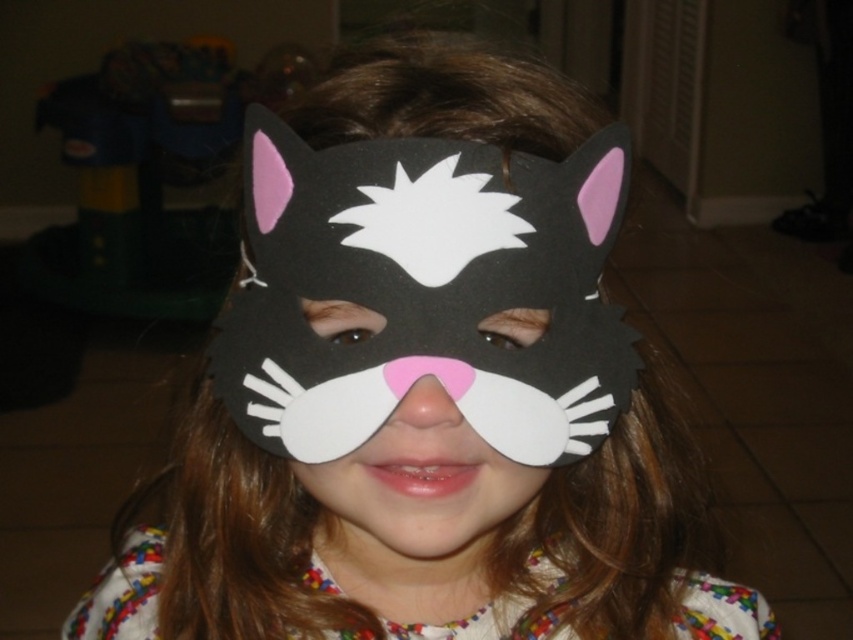
You are a photographer adjusting your camera to focus on two points in the image. The first point is at coordinates point (x=286, y=342) and the second point is at point (x=326, y=518). Which point should you focus on first if you want to capture the closest object to the camera?

Point (x=286, y=342) is closer to the viewer than point (x=326, y=518), so you should focus on point (x=286, y=342) first to capture the closest object.

The child is wearing a handmade cat mask. Which mask is visible on top, the matte foam cat mask at center or the matte felt mask at center?

The matte foam cat mask at center is positioned over the matte felt mask at center, so the matte foam cat mask at center is visible on top.

You are a photographer setting up for a photoshoot. You have two masks in front of you, the matte foam cat mask at center and the matte felt mask at center. The child wearing them is standing on a tiled floor. Which mask is located to the right of the other?

The matte foam cat mask at center is positioned on the right side of the matte felt mask at center.